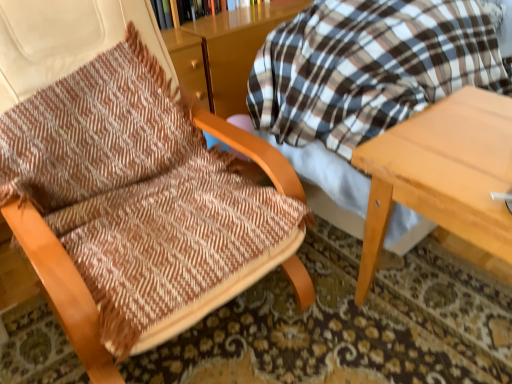
Question: Is wooden bookcase at upper center with brown woven fabric chair at left?

Choices:
 (A) yes
 (B) no

Answer: (B)

Question: From the image's perspective, would you say wooden bookcase at upper center is positioned over brown woven fabric chair at left?

Choices:
 (A) no
 (B) yes

Answer: (B)

Question: Does wooden bookcase at upper center come in front of brown woven fabric chair at left?

Choices:
 (A) yes
 (B) no

Answer: (B)

Question: Does wooden bookcase at upper center have a greater width compared to brown woven fabric chair at left?

Choices:
 (A) no
 (B) yes

Answer: (A)

Question: Is there a large distance between wooden bookcase at upper center and brown woven fabric chair at left?

Choices:
 (A) yes
 (B) no

Answer: (B)

Question: Is wooden bookcase at upper center located outside brown woven fabric chair at left?

Choices:
 (A) yes
 (B) no

Answer: (A)

Question: From a real-world perspective, is light wood table at right positioned over brown woven fabric chair at left based on gravity?

Choices:
 (A) no
 (B) yes

Answer: (A)

Question: Can you confirm if light wood table at right is wider than brown woven fabric chair at left?

Choices:
 (A) yes
 (B) no

Answer: (B)

Question: Is light wood table at right to the left of brown woven fabric chair at left from the viewer's perspective?

Choices:
 (A) yes
 (B) no

Answer: (B)

Question: Does light wood table at right turn towards brown woven fabric chair at left?

Choices:
 (A) no
 (B) yes

Answer: (A)

Question: Considering the relative sizes of light wood table at right and brown woven fabric chair at left in the image provided, is light wood table at right taller than brown woven fabric chair at left?

Choices:
 (A) no
 (B) yes

Answer: (A)

Question: Considering the relative sizes of light wood table at right and brown woven fabric chair at left in the image provided, is light wood table at right shorter than brown woven fabric chair at left?

Choices:
 (A) no
 (B) yes

Answer: (B)

Question: Is wooden bookcase at upper center completely or partially outside of light wood table at right?

Choices:
 (A) no
 (B) yes

Answer: (B)